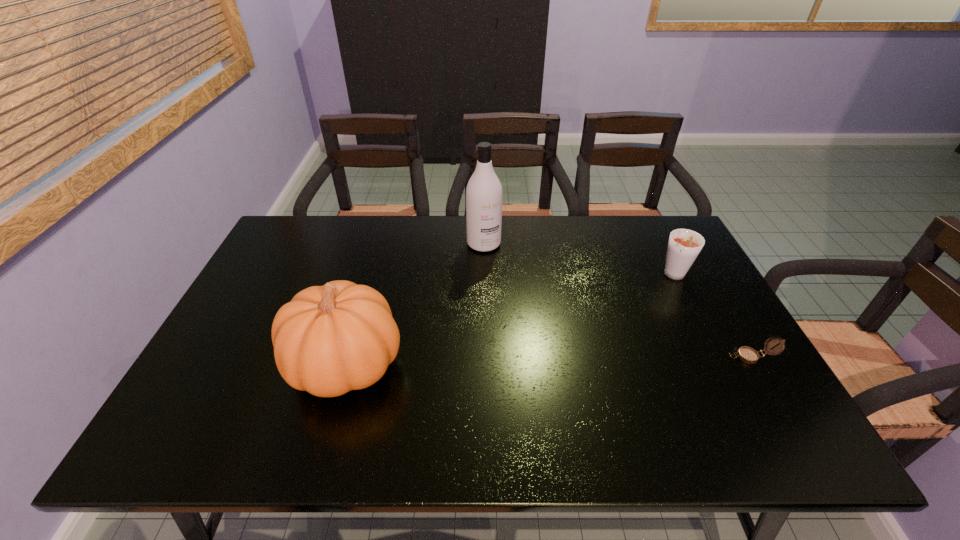
This screenshot has width=960, height=540. What are the coordinates of `vacant space located on the face of the shortest object` in the screenshot? It's located at (588, 357).

Identify the location of vacant space located 0.280m on the drink side of the root beer. This screenshot has height=540, width=960. (614, 336).

Locate an element on the screen. free region located 0.140m on the drink side of the root beer is located at coordinates (643, 309).

Find the location of a particular element. vacant space located 0.100m on the drink side of the root beer is located at coordinates (651, 302).

Image resolution: width=960 pixels, height=540 pixels. Find the location of `vacant space located on the front-facing side of the tallest object`. vacant space located on the front-facing side of the tallest object is located at coordinates (502, 278).

This screenshot has height=540, width=960. I want to click on vacant region located on the front-facing side of the tallest object, so click(x=534, y=336).

What are the coordinates of `vacant space situated 0.160m on the front-facing side of the tallest object` in the screenshot? It's located at (507, 286).

Identify the location of object that is at the far edge. (484, 191).

Identify the location of object that is at the near edge. This screenshot has height=540, width=960. (328, 340).

This screenshot has height=540, width=960. Identify the location of compass present at the right edge. (748, 355).